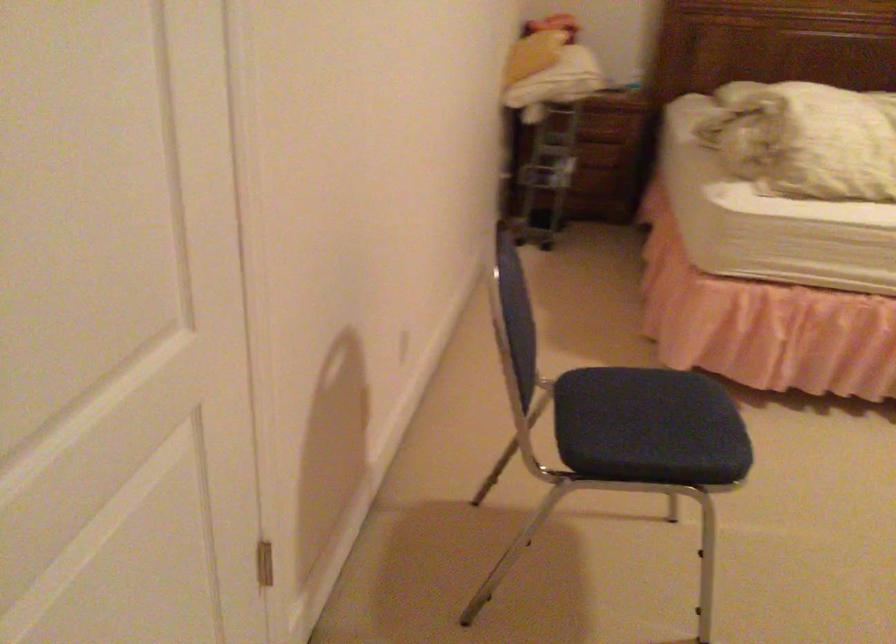
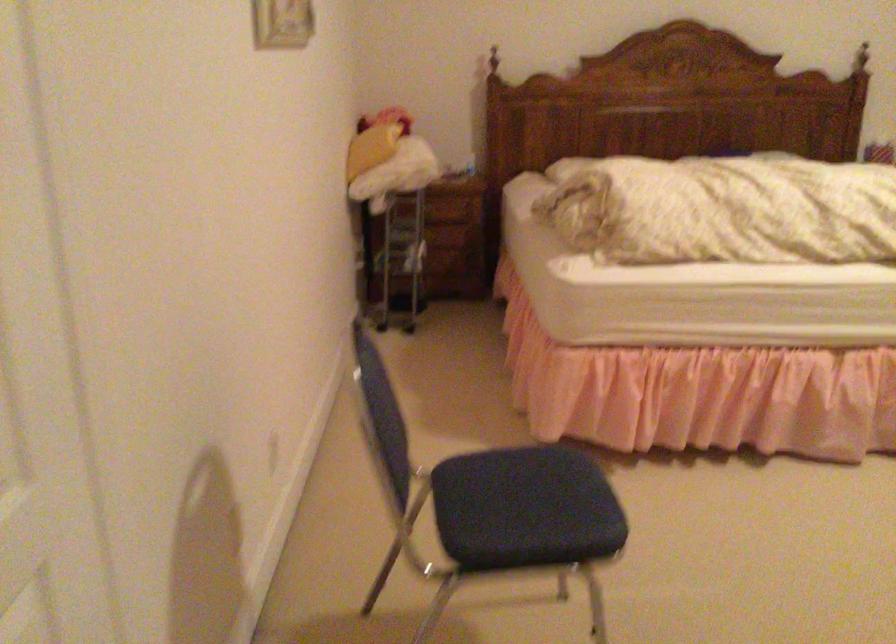
What movement of the cameraman would produce the second image?

The cameraman moved toward right, backward.